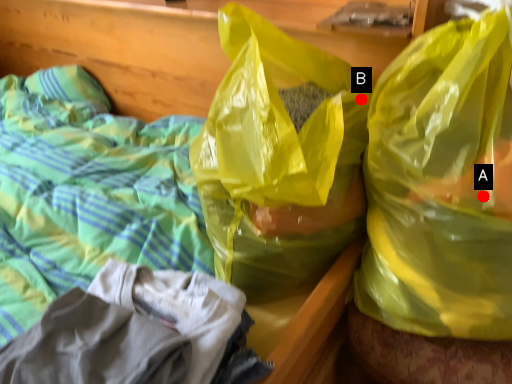
Question: Two points are circled on the image, labeled by A and B beside each circle. Which point is closer to the camera taking this photo?

Choices:
 (A) A is closer
 (B) B is closer

Answer: (A)